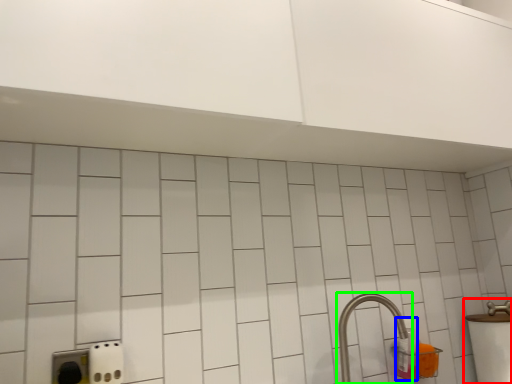
Question: Which object is positioned farthest from sink (highlighted by a red box)? Select from bottle (highlighted by a blue box) and tap (highlighted by a green box).

Choices:
 (A) bottle
 (B) tap

Answer: (B)